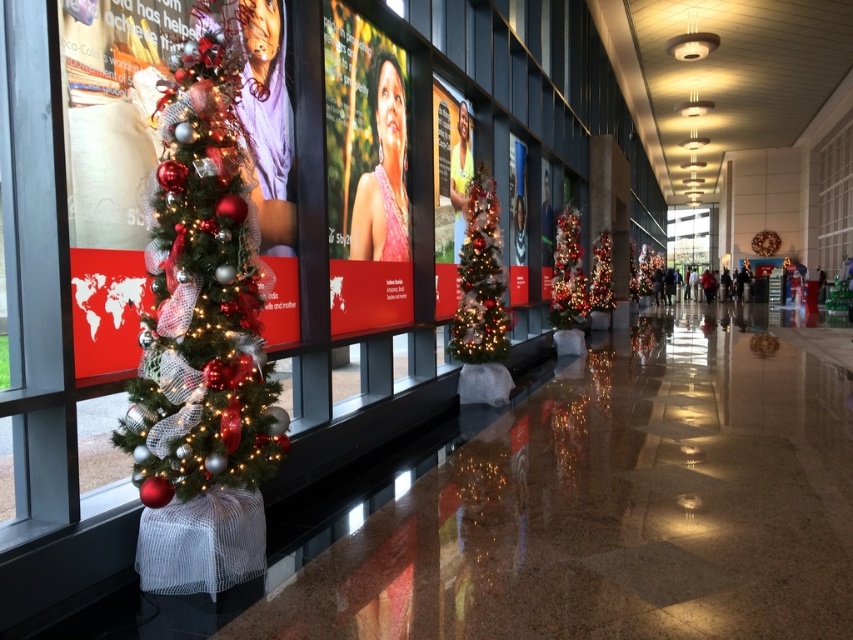
You are standing in the corridor and want to place a new poster between the shiny red and silver christmas tree at left and the shiny red christmas tree at center. Based on their positions, which christmas tree should the poster be closer to?

The shiny red and silver christmas tree at left is to the left of the shiny red christmas tree at center, so the poster should be placed closer to the shiny red christmas tree at center.

You are a janitor in the corridor and need to clean around both the shiny silver christmas tree at center and the shiny red christmas tree at center. Which tree will require you to clean a smaller area around it?

The shiny silver christmas tree at center occupies less space than the shiny red christmas tree at center, so it will require cleaning a smaller area around it.

You are a delivery person carrying a box that is 5 meters long. You need to move it through the corridor where the shiny silver christmas tree at center and the shiny silver tinsel at center are located. Can you fit the box between them?

The distance between the shiny silver christmas tree at center and the shiny silver tinsel at center is 5.13 meters. Since your box is 5 meters long, it will fit between them with 0.13 meters of space remaining.